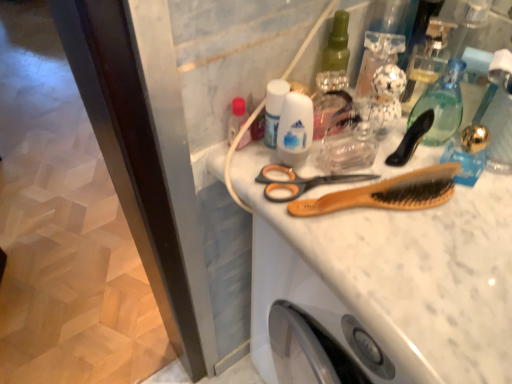
Locate an element on the screen. This screenshot has width=512, height=384. free space in front of matte plastic bottle at upper left, marked as the second toiletry in a right-to-left arrangement is located at coordinates (298, 219).